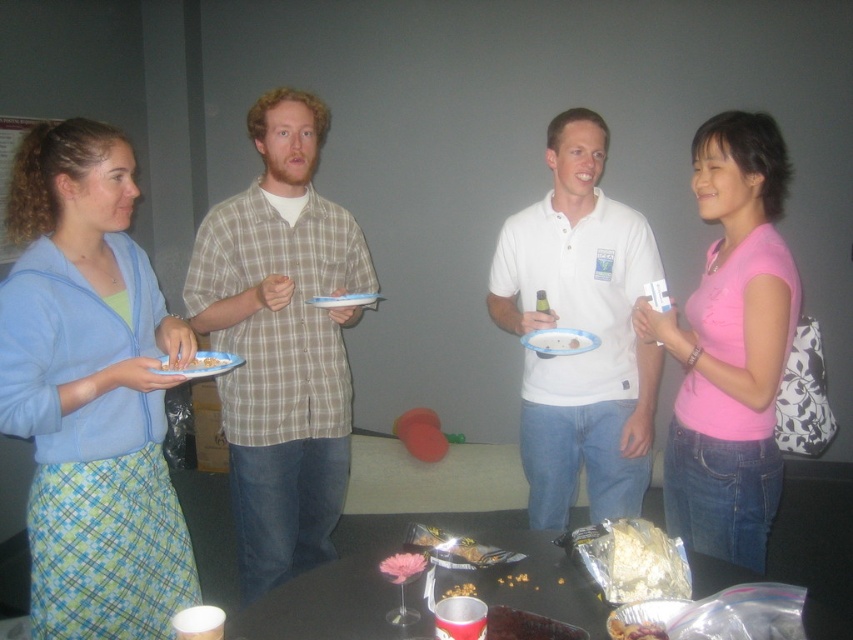
Measure the distance between light blue fabric sweater at left and matte plastic bottle at center.

The distance of light blue fabric sweater at left from matte plastic bottle at center is 37.22 inches.

Does point (85, 305) come farther from viewer compared to point (583, 346)?

No, (85, 305) is closer to viewer.

You are a GUI agent. You are given a task and a screenshot of the screen. Output one action in this format:
    pyautogui.click(x=<x>, y=<y>)
    Task: Click on the light blue fabric sweater at left
    
    Given the screenshot: What is the action you would take?
    pyautogui.click(x=90, y=392)

Between point (846, 608) and point (547, 339), which one is positioned behind?

The point (846, 608) is more distant.

Between black glossy table at lower center and matte plastic bottle at center, which one has less height?

With less height is matte plastic bottle at center.

What do you see at coordinates (436, 582) in the screenshot?
I see `black glossy table at lower center` at bounding box center [436, 582].

This screenshot has width=853, height=640. I want to click on black glossy table at lower center, so click(x=436, y=582).

The height and width of the screenshot is (640, 853). What are the coordinates of `light blue fabric sweater at left` in the screenshot? It's located at (90, 392).

Does light blue fabric sweater at left have a greater width compared to plaid shirt at center?

No, light blue fabric sweater at left is not wider than plaid shirt at center.

Who is more forward, (165, 340) or (239, 465)?

Point (165, 340)

Locate an element on the screen. The height and width of the screenshot is (640, 853). light blue fabric sweater at left is located at coordinates (90, 392).